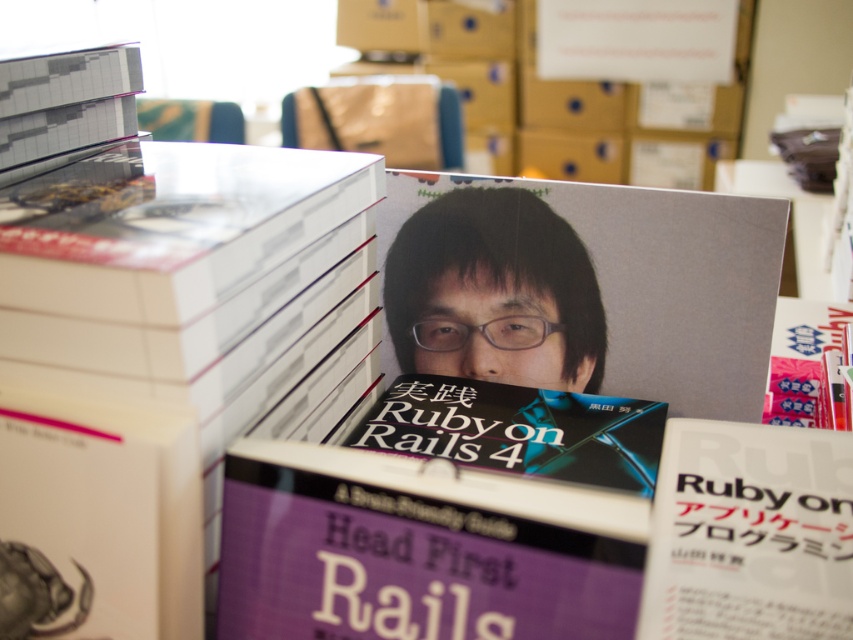
What do you see at coordinates (749, 532) in the screenshot?
I see `white paper book at center` at bounding box center [749, 532].

Can you confirm if white paper book at center is smaller than matte black book at center?

Correct, white paper book at center occupies less space than matte black book at center.

Image resolution: width=853 pixels, height=640 pixels. Find the location of `white paper book at center`. white paper book at center is located at coordinates (749, 532).

Locate an element on the screen. This screenshot has width=853, height=640. white paper book at center is located at coordinates (749, 532).

Can you confirm if white paper book at center is thinner than gray matte book at upper right?

Indeed, white paper book at center has a lesser width compared to gray matte book at upper right.

Is white paper book at center shorter than gray matte book at upper right?

Indeed, white paper book at center has a lesser height compared to gray matte book at upper right.

Image resolution: width=853 pixels, height=640 pixels. In order to click on white paper book at center in this screenshot , I will do `click(749, 532)`.

Locate an element on the screen. The image size is (853, 640). white paper book at center is located at coordinates (749, 532).

Is point (590, 276) positioned in front of point (416, 454)?

No, (590, 276) is behind (416, 454).

Is matte black book at center to the left of black matte book at center from the viewer's perspective?

Yes, matte black book at center is to the left of black matte book at center.

What are the coordinates of `matte black book at center` in the screenshot? It's located at (494, 292).